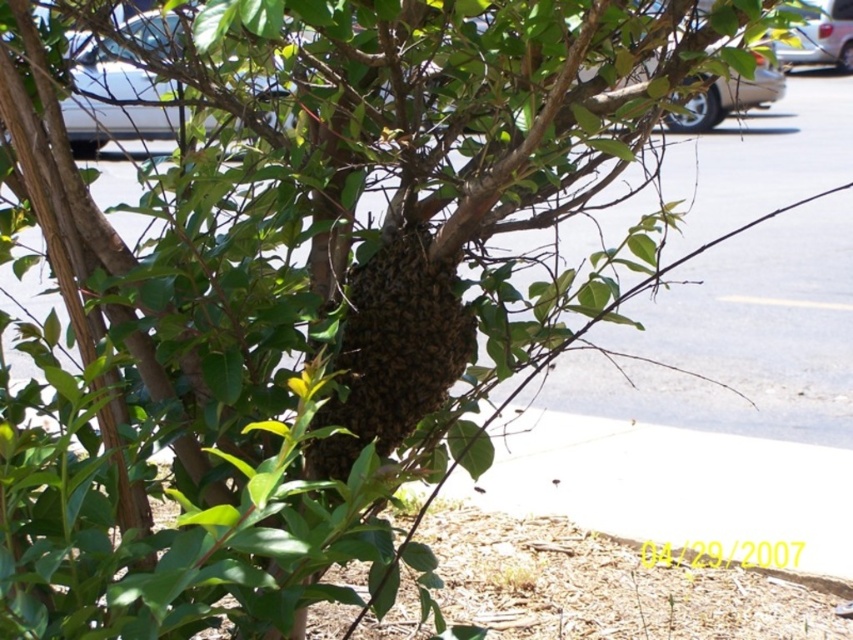
Question: Does brown fuzzy beehive at center have a smaller size compared to metallic silver car at upper left?

Choices:
 (A) yes
 (B) no

Answer: (A)

Question: Is metallic silver car at upper left bigger than silver metallic car at upper right?

Choices:
 (A) no
 (B) yes

Answer: (B)

Question: Which of these objects is positioned closest to the brown fuzzy beehive at center?

Choices:
 (A) silver metallic car at upper right
 (B) metallic silver car at upper left
 (C) metallic gold car at upper center

Answer: (B)

Question: Which of these objects is positioned closest to the metallic silver car at upper left?

Choices:
 (A) brown fuzzy beehive at center
 (B) silver metallic car at upper right
 (C) metallic gold car at upper center

Answer: (A)

Question: Can you confirm if brown fuzzy beehive at center is smaller than metallic gold car at upper center?

Choices:
 (A) yes
 (B) no

Answer: (A)

Question: Among these objects, which one is nearest to the camera?

Choices:
 (A) metallic silver car at upper left
 (B) silver metallic car at upper right
 (C) metallic gold car at upper center
 (D) brown fuzzy beehive at center

Answer: (A)